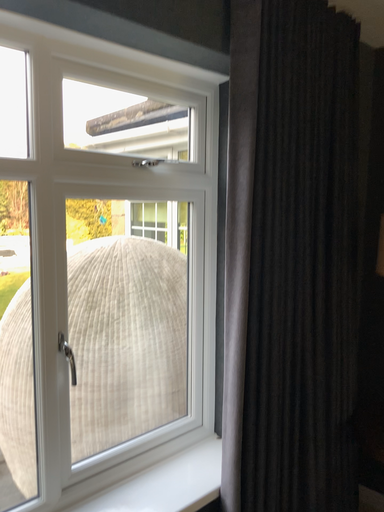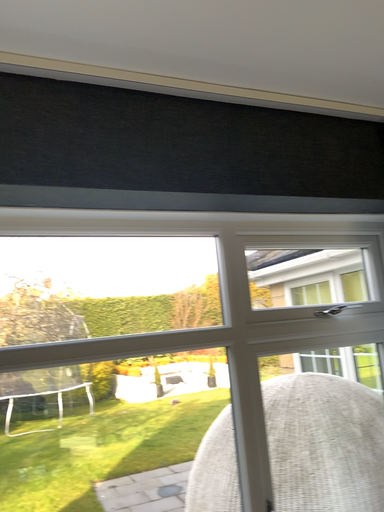
Question: Which way did the camera rotate in the video?

Choices:
 (A) rotated downward
 (B) rotated upward

Answer: (B)